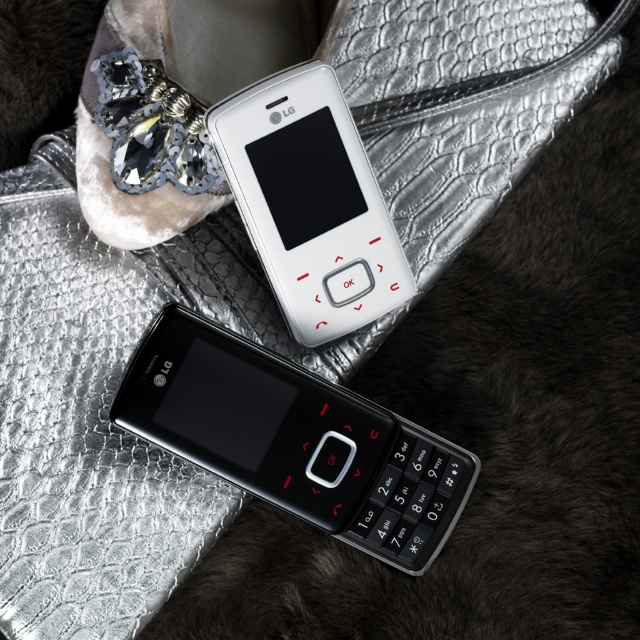
Can you confirm if black fuzzy fur at lower right is positioned to the right of black matte phone at center?

Indeed, black fuzzy fur at lower right is positioned on the right side of black matte phone at center.

Is black fuzzy fur at lower right thinner than black matte phone at center?

No, black fuzzy fur at lower right is not thinner than black matte phone at center.

Identify the location of black fuzzy fur at lower right. (490, 428).

Does black fuzzy fur at lower right lie in front of white matte phone at center?

No, it is not.

Does black fuzzy fur at lower right have a lesser width compared to white matte phone at center?

In fact, black fuzzy fur at lower right might be wider than white matte phone at center.

Is point (516, 406) more distant than point (324, 307)?

That is True.

Find the location of a particular element. Image resolution: width=640 pixels, height=640 pixels. black fuzzy fur at lower right is located at coordinates (490, 428).

Based on the photo, can you confirm if black matte phone at center is bigger than white matte phone at center?

Indeed, black matte phone at center has a larger size compared to white matte phone at center.

Is the position of black matte phone at center more distant than that of white matte phone at center?

Yes.

Is point (212, 417) in front of point (388, 284)?

Yes, it is in front of point (388, 284).

At what (x,y) coordinates should I click in order to perform the action: click on black matte phone at center. Please return your answer as a coordinate pair (x, y). Looking at the image, I should click on (294, 440).